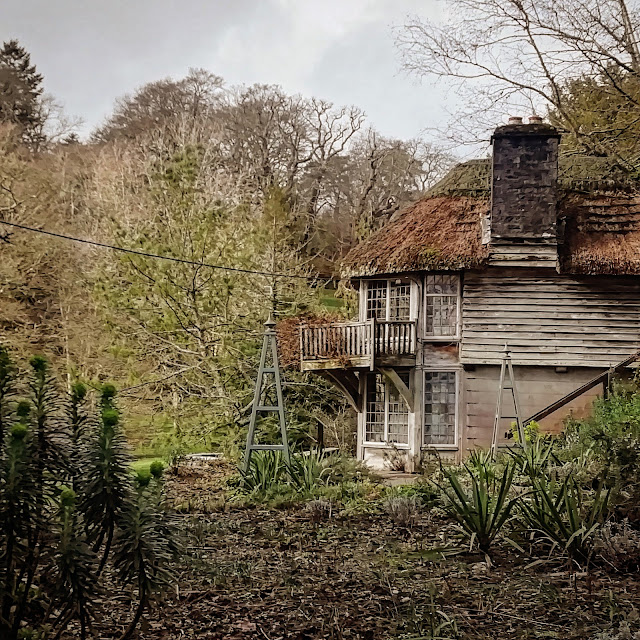
This screenshot has width=640, height=640. Find the location of `space below railing`. space below railing is located at coordinates (564, 408).